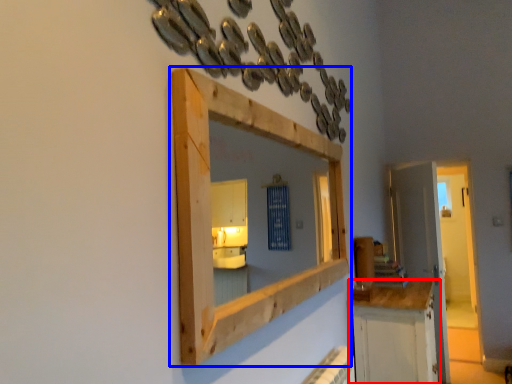
Question: Among these objects, which one is nearest to the camera, cabinetry (highlighted by a red box) or medicine cabinet (highlighted by a blue box)?

Choices:
 (A) cabinetry
 (B) medicine cabinet

Answer: (B)